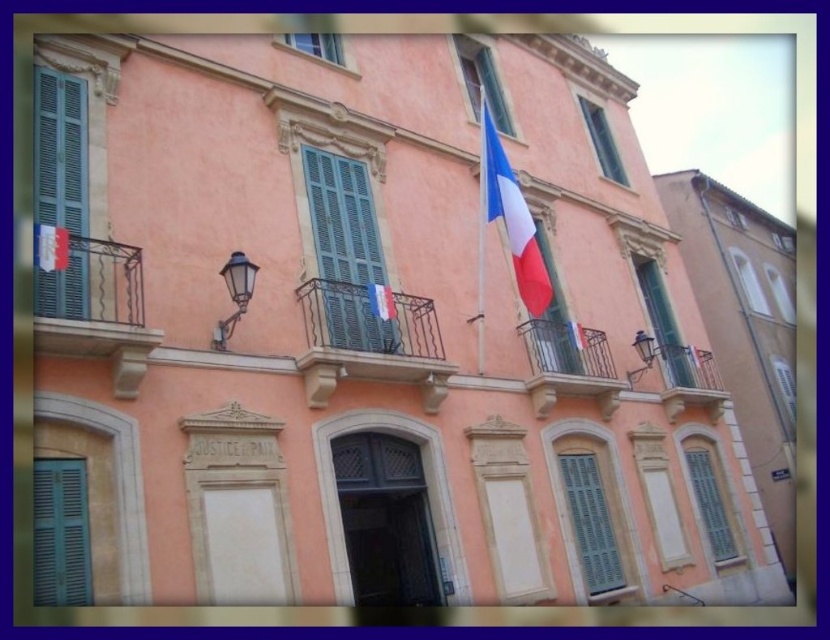
Question: Which point is closer to the camera?

Choices:
 (A) green matte shutter at lower left
 (B) clear glass window at center

Answer: (A)

Question: Which object is closer to the camera taking this photo?

Choices:
 (A) teal matte shutters at center
 (B) white matte window at upper right
 (C) matte glass window at right
 (D) matte glass window at center

Answer: (A)

Question: Which of the following is the farthest from the observer?

Choices:
 (A) (582, 385)
 (B) (779, 364)

Answer: (B)

Question: Can you confirm if rustic wood balcony at center is thinner than matte glass window at center?

Choices:
 (A) no
 (B) yes

Answer: (A)

Question: Can you confirm if rustic wood balcony at center is positioned below matte glass window at upper center?

Choices:
 (A) no
 (B) yes

Answer: (B)

Question: Is teal matte shutters at center wider than green matte window at lower right?

Choices:
 (A) yes
 (B) no

Answer: (A)